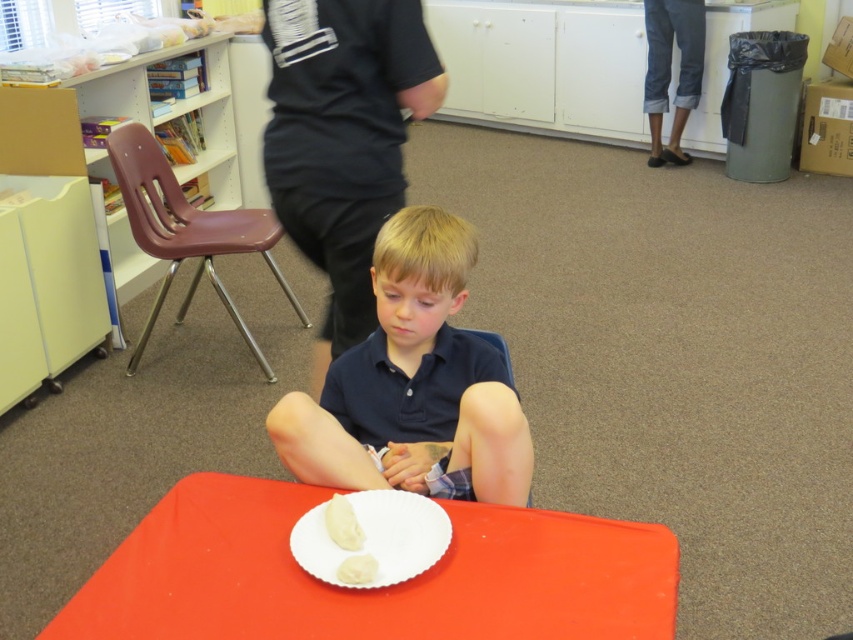
Is white paper plate at center to the right of white matte dumpling at center from the viewer's perspective?

Yes, white paper plate at center is to the right of white matte dumpling at center.

Is point (381, 556) positioned behind point (354, 516)?

No, (381, 556) is in front of (354, 516).

This screenshot has height=640, width=853. I want to click on white paper plate at center, so click(376, 536).

In the scene shown: Does dark blue shirt at center appear on the left side of white paper plate at center?

No, dark blue shirt at center is not to the left of white paper plate at center.

Is point (372, 369) more distant than point (381, 532)?

Yes, point (372, 369) is behind point (381, 532).

Is point (413, 470) positioned in front of point (404, 561)?

No, it is behind (404, 561).

You are a GUI agent. You are given a task and a screenshot of the screen. Output one action in this format:
    pyautogui.click(x=<x>, y=<y>)
    Task: Click on the dark blue shirt at center
    Image resolution: width=853 pixels, height=640 pixels.
    Given the screenshot: What is the action you would take?
    pyautogui.click(x=412, y=381)

Is point (209, 570) closer to camera compared to point (344, 560)?

No, (209, 570) is further to viewer.

Who is taller, smooth plastic table at center or white creamy cake at center?

With more height is smooth plastic table at center.

You are a GUI agent. You are given a task and a screenshot of the screen. Output one action in this format:
    pyautogui.click(x=<x>, y=<y>)
    Task: Click on the smooth plastic table at center
    
    Given the screenshot: What is the action you would take?
    point(370,589)